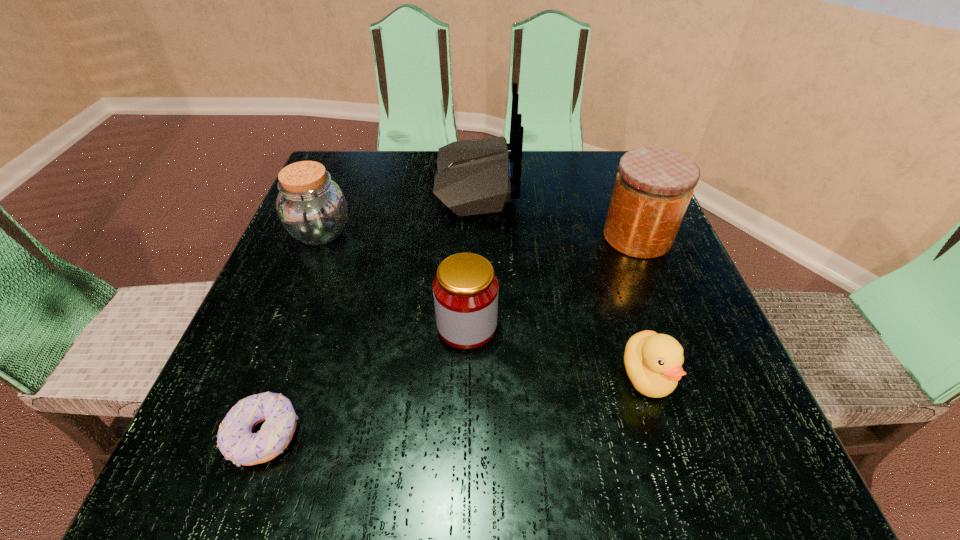
This screenshot has height=540, width=960. In order to click on vacant space at the left edge of the desktop in this screenshot , I will do `click(251, 391)`.

Locate an element on the screen. The width and height of the screenshot is (960, 540). vacant area at the right edge of the desktop is located at coordinates (721, 372).

In the image, there is a desktop. Identify the location of blank space at the far left corner. The image size is (960, 540). (362, 199).

This screenshot has height=540, width=960. What are the coordinates of `vacant region at the far right corner of the desktop` in the screenshot? It's located at (592, 173).

The width and height of the screenshot is (960, 540). I want to click on free spot between the nearest jar and the rightmost jar, so click(x=552, y=281).

Identify the location of unoccupied area between the shortest object and the router. This screenshot has height=540, width=960. (370, 309).

Identify the location of vacant area that lies between the second jar from right to left and the leftmost jar. (394, 279).

Identify the location of free space between the router and the rightmost jar. (556, 210).

Image resolution: width=960 pixels, height=540 pixels. Identify the location of free spot between the doughnut and the nearest jar. (366, 381).

In order to click on empty location between the router and the shortest object in this screenshot , I will do `click(370, 309)`.